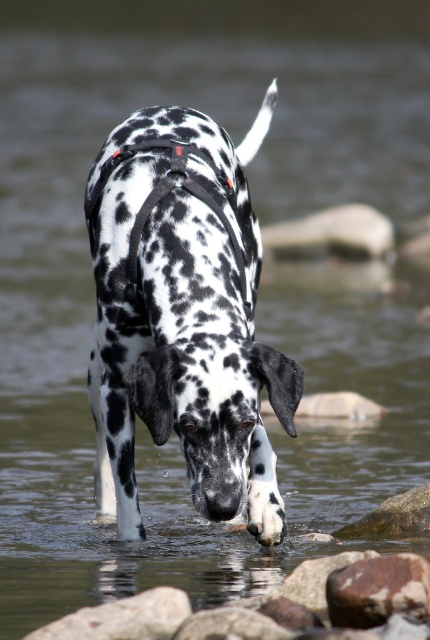
Can you confirm if spotted fur at center is bigger than rustic brown rock at lower right?

Yes.

Can you confirm if spotted fur at center is positioned to the left of rustic brown rock at lower right?

Correct, you'll find spotted fur at center to the left of rustic brown rock at lower right.

At what (x,y) coordinates should I click in order to perform the action: click on spotted fur at center. Please return your answer as a coordinate pair (x, y). This screenshot has height=640, width=430. Looking at the image, I should click on coord(183,317).

Is spotted fur at center taller than smooth brown rock at lower center?

Correct, spotted fur at center is much taller as smooth brown rock at lower center.

Based on the photo, does spotted fur at center appear on the right side of smooth brown rock at lower center?

In fact, spotted fur at center is to the left of smooth brown rock at lower center.

Is point (224, 509) more distant than point (377, 556)?

No, it is in front of (377, 556).

What are the coordinates of `spotted fur at center` in the screenshot? It's located at (183, 317).

Looking at this image, which of these two, smooth brown rock at lower center or rustic brown rock at lower right, stands taller?

smooth brown rock at lower center is taller.

Is smooth brown rock at lower center behind rustic brown rock at lower right?

No.

Measure the distance between smooth brown rock at lower center and camera.

8.52 feet

The image size is (430, 640). Find the location of `smooth brown rock at lower center`. smooth brown rock at lower center is located at coordinates (276, 605).